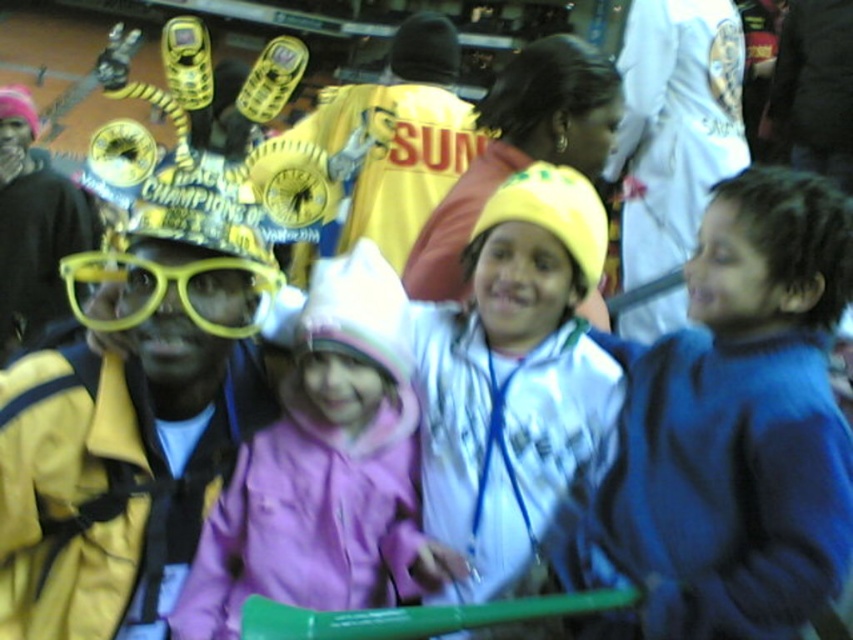
Measure the distance between point (39, 602) and camera.

Point (39, 602) and camera are 12.45 meters apart from each other.

Which is below, yellow matte/glossy goggles at left or pink fleece jacket at center?

pink fleece jacket at center is below.

Is point (105, 464) less distant than point (351, 253)?

Yes, point (105, 464) is closer to viewer.

This screenshot has width=853, height=640. What are the coordinates of `yellow matte/glossy goggles at left` in the screenshot? It's located at (132, 417).

Between point (825, 454) and point (132, 339), which one is positioned behind?

The point (132, 339) is behind.

Does blue fleece jacket at right appear on the left side of yellow matte/glossy goggles at left?

No, blue fleece jacket at right is not to the left of yellow matte/glossy goggles at left.

This screenshot has width=853, height=640. Identify the location of blue fleece jacket at right. (737, 428).

Identify the location of blue fleece jacket at right. This screenshot has width=853, height=640. (737, 428).

Which is behind, point (808, 282) or point (248, 454)?

The point (248, 454) is more distant.

Which is above, blue fleece jacket at right or pink fleece jacket at center?

pink fleece jacket at center

Does point (741, 177) come farther from viewer compared to point (404, 589)?

Yes.

Image resolution: width=853 pixels, height=640 pixels. Identify the location of blue fleece jacket at right. (737, 428).